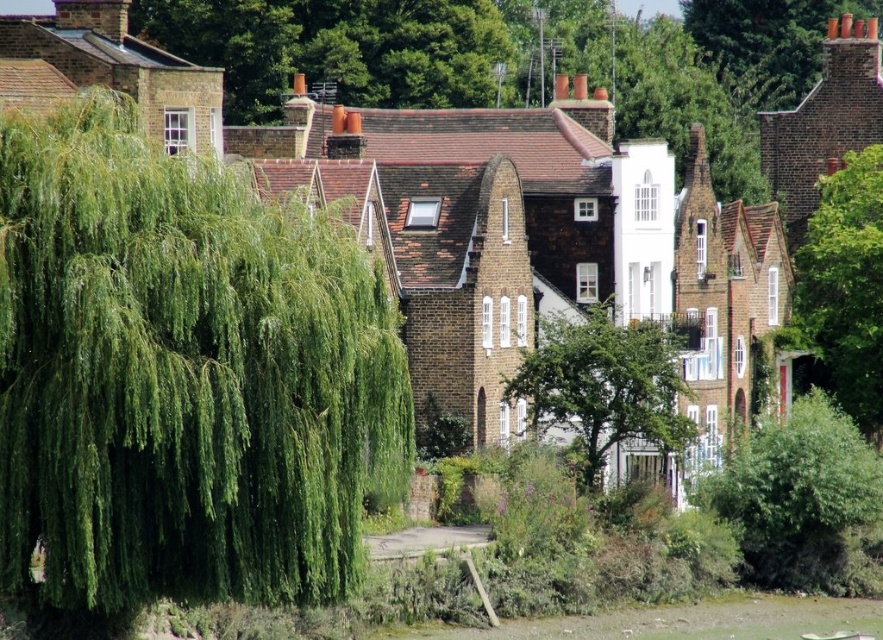
Question: Which object is the farthest from the green leafy bush at lower right?

Choices:
 (A) green leafy willow at left
 (B) green leafy tree at center

Answer: (A)

Question: Observing the image, what is the correct spatial positioning of green leafy willow at left in reference to green leafy tree at right?

Choices:
 (A) right
 (B) left

Answer: (B)

Question: Among these points, which one is nearest to the camera?

Choices:
 (A) (865, 416)
 (B) (606, 324)

Answer: (B)

Question: Can you confirm if green leafy bush at lower right is thinner than green leafy tree at center?

Choices:
 (A) no
 (B) yes

Answer: (A)

Question: Is green leafy bush at lower right further to the viewer compared to green leafy tree at right?

Choices:
 (A) yes
 (B) no

Answer: (B)

Question: Based on their relative distances, which object is farther from the green leafy tree at center?

Choices:
 (A) green leafy bush at lower right
 (B) green leafy tree at right

Answer: (B)